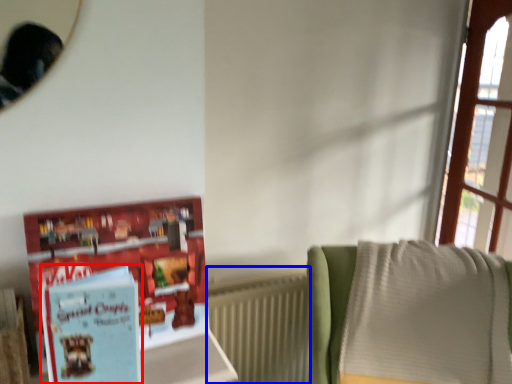
Question: Which of the following is the closest to the observer, paperback book (highlighted by a red box) or radiator (highlighted by a blue box)?

Choices:
 (A) paperback book
 (B) radiator

Answer: (A)